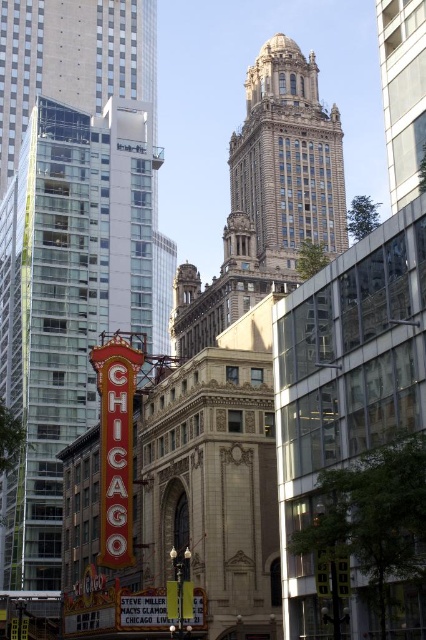
Question: Does red glass building at left lie behind brown stone tower at upper center?

Choices:
 (A) no
 (B) yes

Answer: (A)

Question: Is red glass building at left wider than brown stone tower at upper center?

Choices:
 (A) no
 (B) yes

Answer: (A)

Question: Among these points, which one is farthest from the camera?

Choices:
 (A) (141, 294)
 (B) (236, 228)

Answer: (B)

Question: Is red glass building at left bigger than brown stone tower at upper center?

Choices:
 (A) no
 (B) yes

Answer: (B)